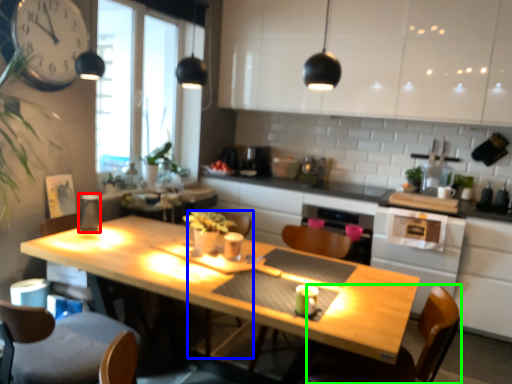
Question: Estimate the real-world distances between objects in this image. Which object is farther from appliance (highlighted by a red box), armchair (highlighted by a blue box) or swivel chair (highlighted by a green box)?

Choices:
 (A) armchair
 (B) swivel chair

Answer: (B)